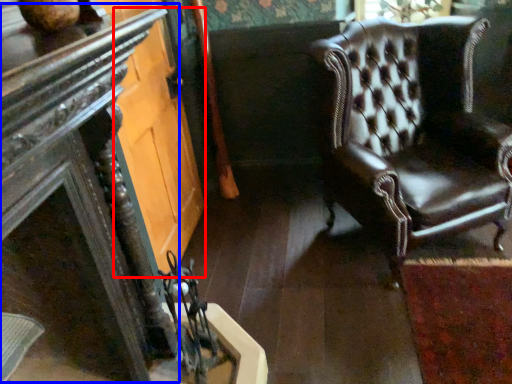
Question: Which of the following is the closest to the observer, glass door (highlighted by a red box) or table (highlighted by a blue box)?

Choices:
 (A) glass door
 (B) table

Answer: (B)